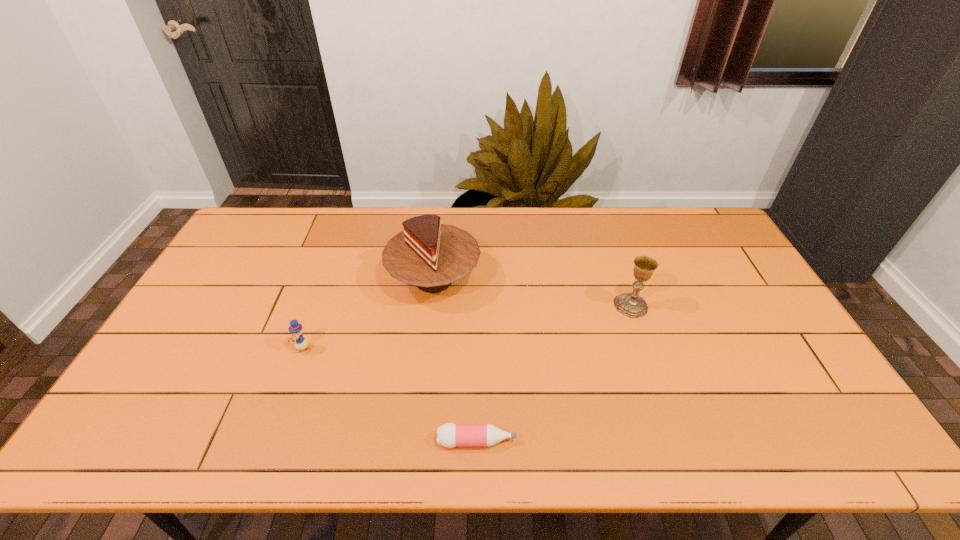
Image resolution: width=960 pixels, height=540 pixels. Identify the location of vacant point located between the shortest object and the rightmost object. (554, 373).

I want to click on free space between the shortest object and the cake, so click(455, 360).

The height and width of the screenshot is (540, 960). Identify the location of empty space between the cake and the nearest object. (455, 360).

At what (x,y) coordinates should I click in order to perform the action: click on free space between the chalice and the duckling. Please return your answer as a coordinate pair (x, y). The width and height of the screenshot is (960, 540). Looking at the image, I should click on (467, 327).

This screenshot has height=540, width=960. Find the location of `empty space that is in between the cake and the bottle`. empty space that is in between the cake and the bottle is located at coordinates (455, 360).

Image resolution: width=960 pixels, height=540 pixels. In order to click on vacant space that's between the chalice and the bottle in this screenshot , I will do `click(554, 373)`.

This screenshot has width=960, height=540. What are the coordinates of `the second closest object to the cake` in the screenshot? It's located at click(449, 435).

Choose which object is the third nearest neighbor to the nearest object. Please provide its 2D coordinates. Your answer should be formatted as a tuple, i.e. [(x, y)], where the tuple contains the x and y coordinates of a point satisfying the conditions above.

[(632, 305)]

Find the location of a particular element. vacant region that satisfies the following two spatial constraints: 1. on the front side of the rightmost object; 2. with the cap open on the shortest object is located at coordinates (677, 441).

Identify the location of vacant space that satisfies the following two spatial constraints: 1. on the front side of the rightmost object; 2. with the cap open on the bottle. This screenshot has width=960, height=540. (677, 441).